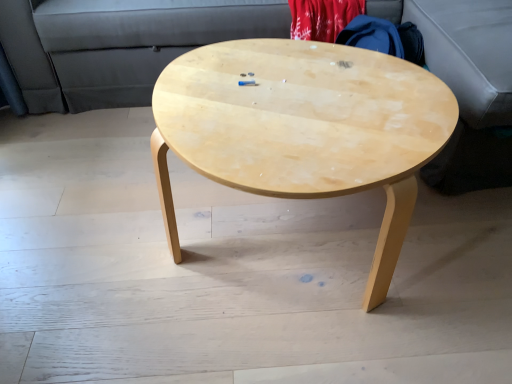
Question: Does natural wood coffee table at center appear on the right side of matte gray couch at upper center?

Choices:
 (A) yes
 (B) no

Answer: (A)

Question: From a real-world perspective, is natural wood coffee table at center under matte gray couch at upper center?

Choices:
 (A) no
 (B) yes

Answer: (B)

Question: From the image's perspective, is natural wood coffee table at center on top of matte gray couch at upper center?

Choices:
 (A) no
 (B) yes

Answer: (A)

Question: Is natural wood coffee table at center closer to camera compared to matte gray couch at upper center?

Choices:
 (A) yes
 (B) no

Answer: (A)

Question: Does natural wood coffee table at center have a lesser height compared to matte gray couch at upper center?

Choices:
 (A) yes
 (B) no

Answer: (A)

Question: Does natural wood coffee table at center have a lesser width compared to matte gray couch at upper center?

Choices:
 (A) no
 (B) yes

Answer: (B)

Question: Is the position of matte gray couch at upper center more distant than that of natural wood coffee table at center?

Choices:
 (A) yes
 (B) no

Answer: (A)

Question: Does matte gray couch at upper center appear on the left side of natural wood coffee table at center?

Choices:
 (A) yes
 (B) no

Answer: (A)

Question: Considering the relative sizes of matte gray couch at upper center and natural wood coffee table at center in the image provided, is matte gray couch at upper center taller than natural wood coffee table at center?

Choices:
 (A) yes
 (B) no

Answer: (A)

Question: From the image's perspective, does matte gray couch at upper center appear lower than natural wood coffee table at center?

Choices:
 (A) yes
 (B) no

Answer: (B)

Question: Does matte gray couch at upper center have a smaller size compared to natural wood coffee table at center?

Choices:
 (A) yes
 (B) no

Answer: (B)

Question: Are matte gray couch at upper center and natural wood coffee table at center beside each other?

Choices:
 (A) no
 (B) yes

Answer: (A)

Question: Is natural wood coffee table at center spatially inside matte gray couch at upper center, or outside of it?

Choices:
 (A) inside
 (B) outside

Answer: (B)